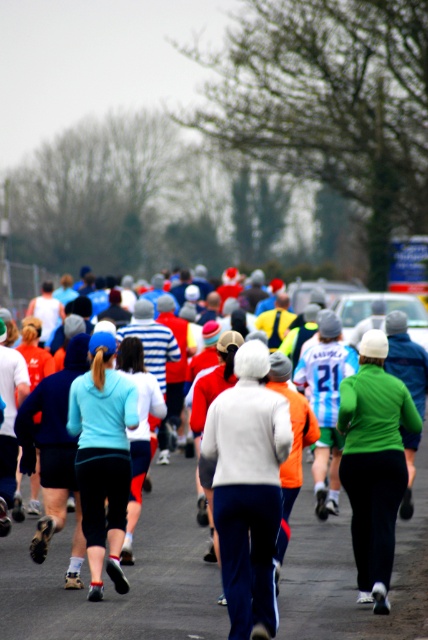
Question: Considering the relative positions of light blue fabric at center and light blue jersey at center in the image provided, where is light blue fabric at center located with respect to light blue jersey at center?

Choices:
 (A) right
 (B) left

Answer: (B)

Question: Considering the real-world distances, which object is farthest from the green matte jacket at center?

Choices:
 (A) white fleece jacket at center
 (B) light blue fabric at center
 (C) light blue jersey at center
 (D) matte white jacket at center

Answer: (D)

Question: Is matte white jacket at center above white fleece jacket at center?

Choices:
 (A) yes
 (B) no

Answer: (B)

Question: Which of the following is the closest to the observer?

Choices:
 (A) light blue jersey at center
 (B) matte white jacket at center

Answer: (B)

Question: Which point appears farthest from the camera in this image?

Choices:
 (A) (371, 552)
 (B) (95, 536)
 (C) (318, 401)

Answer: (C)

Question: Is green matte jacket at center to the right of light blue fabric at center from the viewer's perspective?

Choices:
 (A) no
 (B) yes

Answer: (B)